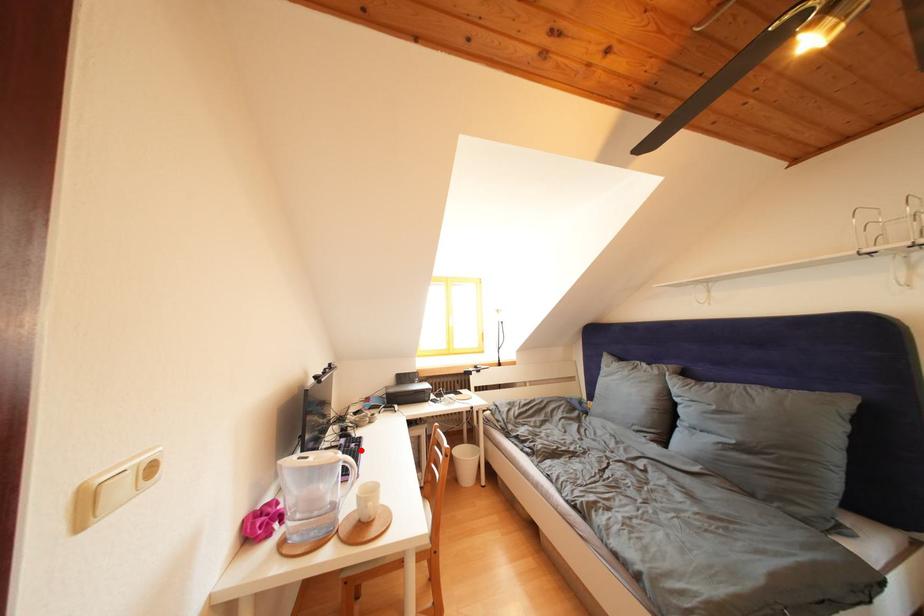
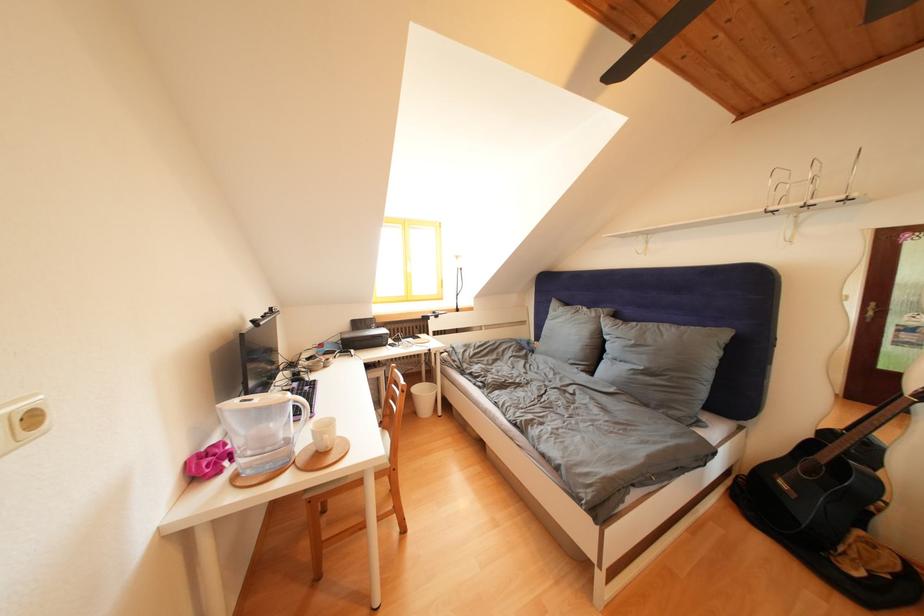
In the second image, find the point that corresponds to the highlighted location in the first image.

(314, 392)